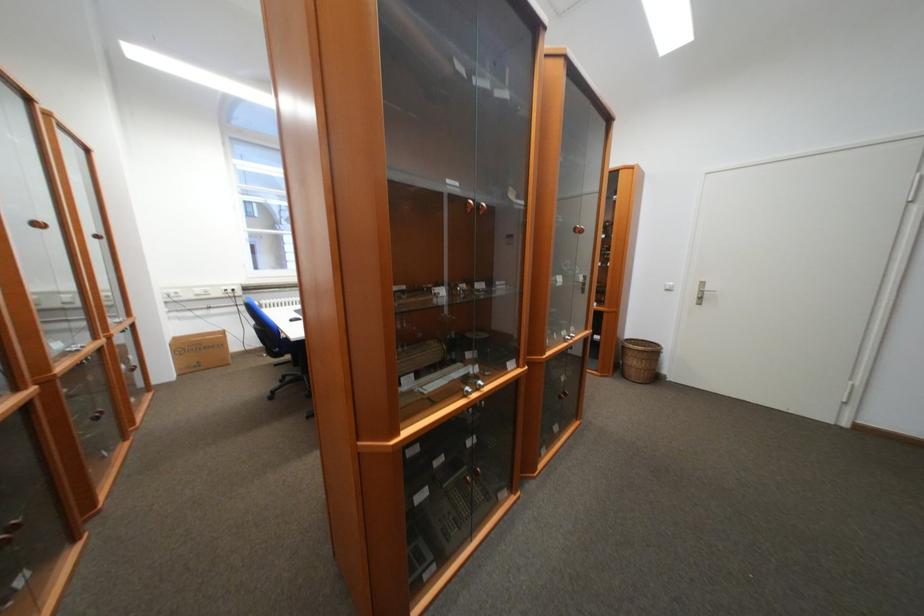
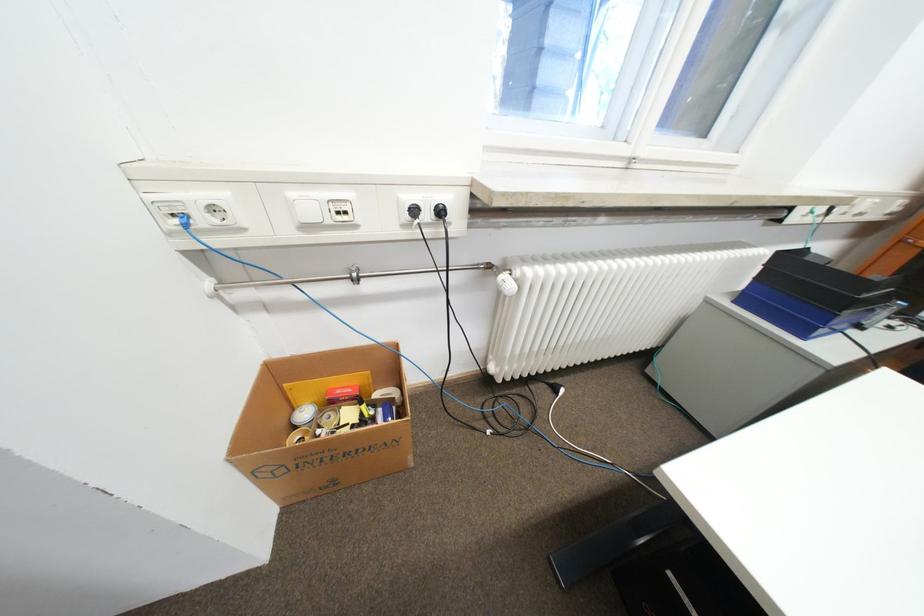
Locate, in the second image, the point that corresponds to [238,292] in the first image.

(436, 216)